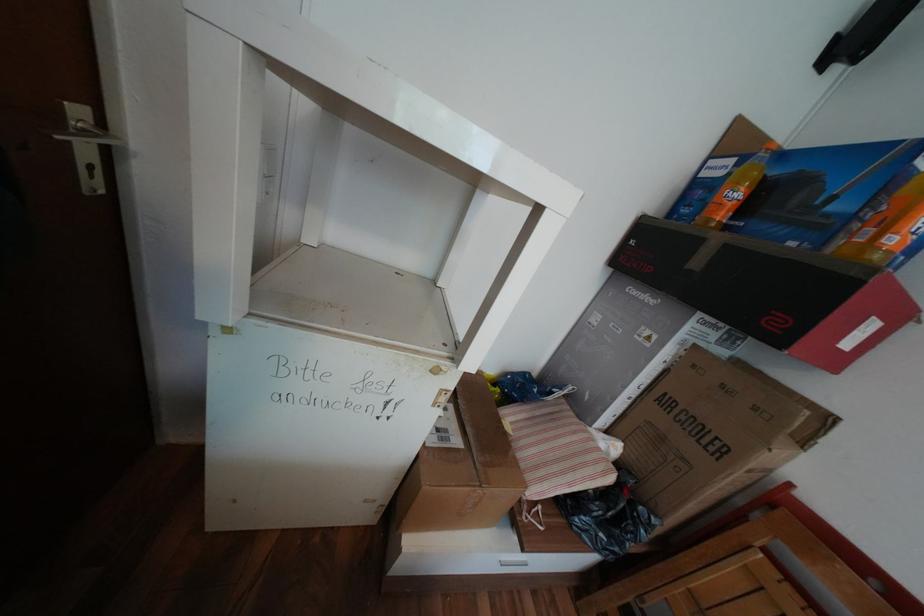
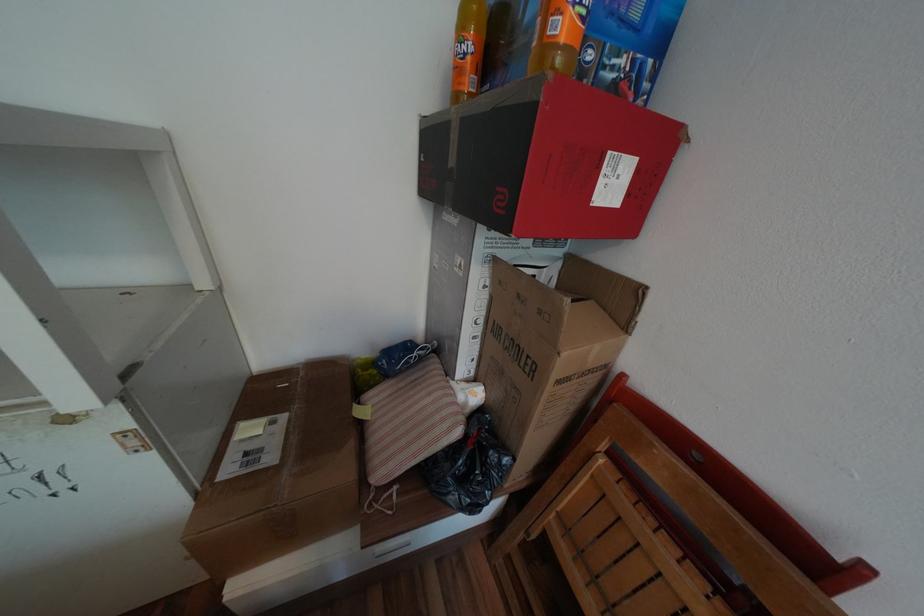
In the second image, find the point that corresponds to point (650, 508) in the first image.

(500, 453)